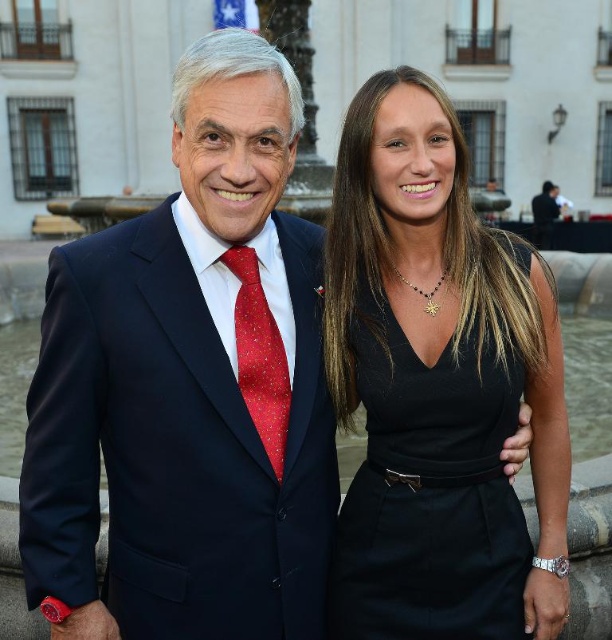
Does navy blue suit at left come behind red dotted fabric tie at left?

That is False.

Is navy blue suit at left positioned before red dotted fabric tie at left?

That is True.

The width and height of the screenshot is (612, 640). Describe the element at coordinates (173, 448) in the screenshot. I see `navy blue suit at left` at that location.

You are a GUI agent. You are given a task and a screenshot of the screen. Output one action in this format:
    pyautogui.click(x=<x>, y=<y>)
    Task: Click on the navy blue suit at left
    This screenshot has height=640, width=612.
    Given the screenshot: What is the action you would take?
    pyautogui.click(x=173, y=448)

Which of these two, navy blue suit at left or black satin dress at center, stands taller?

navy blue suit at left

Is navy blue suit at left shorter than black satin dress at center?

No, navy blue suit at left is not shorter than black satin dress at center.

Between point (192, 550) and point (465, 493), which one is positioned in front?

Positioned in front is point (192, 550).

The image size is (612, 640). I want to click on navy blue suit at left, so click(173, 448).

Does black satin dress at center appear under red dotted fabric tie at left?

Indeed, black satin dress at center is positioned under red dotted fabric tie at left.

Identify the location of black satin dress at center. Image resolution: width=612 pixels, height=640 pixels. point(430,488).